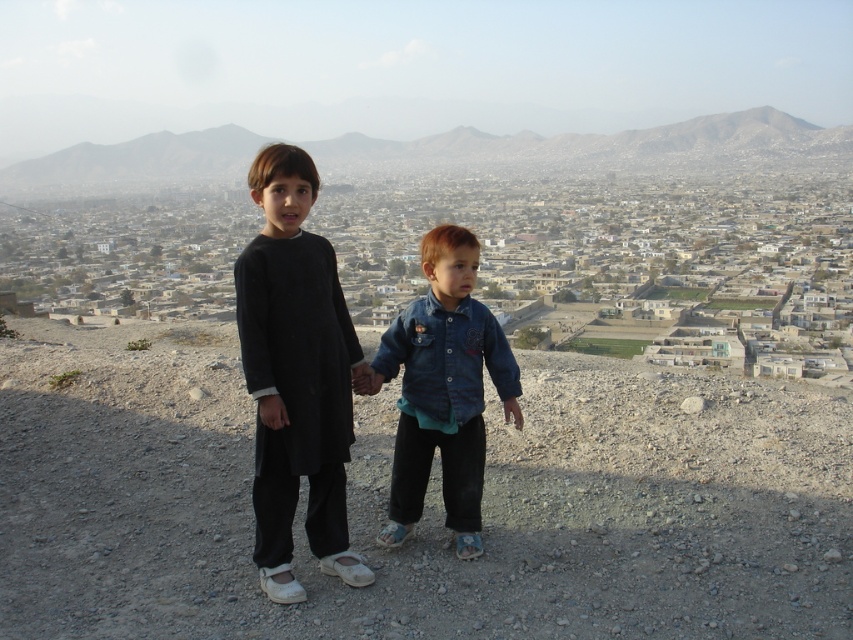
The height and width of the screenshot is (640, 853). Describe the element at coordinates (296, 376) in the screenshot. I see `black cotton kurta at center` at that location.

Who is taller, black cotton kurta at center or gray rocky hill at center?

gray rocky hill at center is taller.

Locate an element on the screen. black cotton kurta at center is located at coordinates [296, 376].

The height and width of the screenshot is (640, 853). Describe the element at coordinates (596, 148) in the screenshot. I see `gray rocky hill at center` at that location.

Which is in front, point (784, 148) or point (508, 394)?

Point (508, 394) is more forward.

What do you see at coordinates (596, 148) in the screenshot?
I see `gray rocky hill at center` at bounding box center [596, 148].

Locate an element on the screen. The height and width of the screenshot is (640, 853). gray rocky hill at center is located at coordinates (596, 148).

Can you confirm if black cotton kurta at center is positioned below denim jacket at center?

No.

The width and height of the screenshot is (853, 640). Identify the location of black cotton kurta at center. (296, 376).